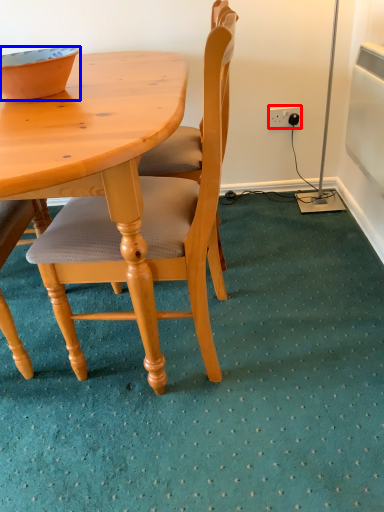
Question: Which object appears farthest to the camera in this image, power outlet (highlighted by a red box) or bowl (highlighted by a blue box)?

Choices:
 (A) power outlet
 (B) bowl

Answer: (A)